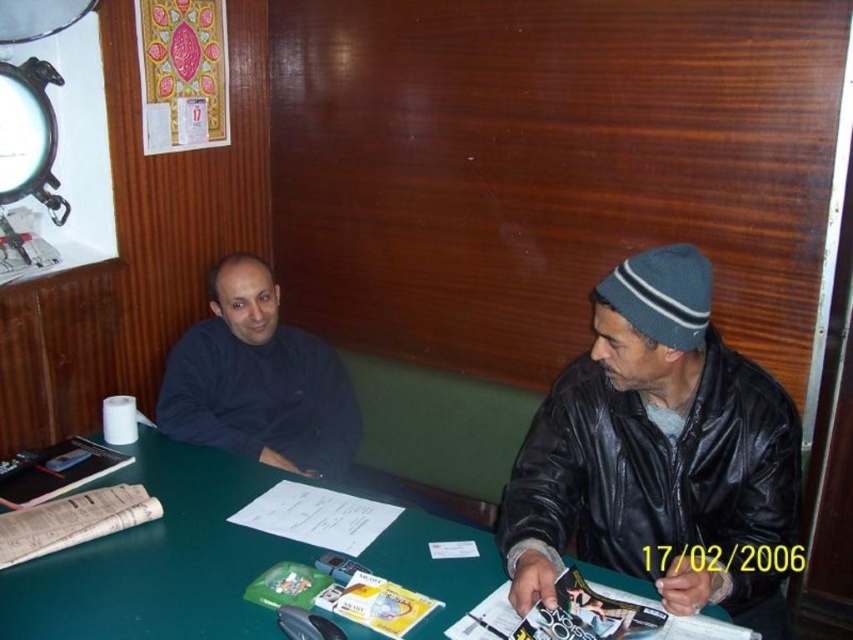
You are standing in the room and want to place a new object between the green matte table at center and the dark blue sweater at center. Based on their positions, which object should you place it closer to?

Since the green matte table at center is to the right of the dark blue sweater at center, you should place the new object closer to the dark blue sweater at center to ensure it is between them.

You are a delivery person trying to place a small package on the green matte table at center. However, there is a dark blue sweater at center on the table. Can the package be placed on the table without moving the sweater?

The green matte table at center is not as tall as dark blue sweater at center, which means the sweater is taller than the table. Since the sweater is already on the table, placing the package might be difficult due to the height difference. The sweater being taller could block the space, so moving it might be necessary.